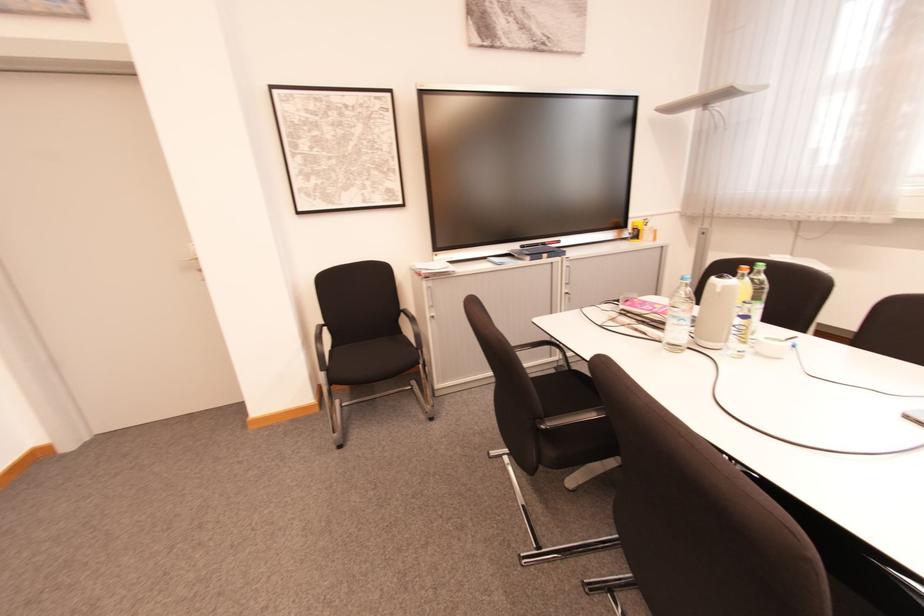
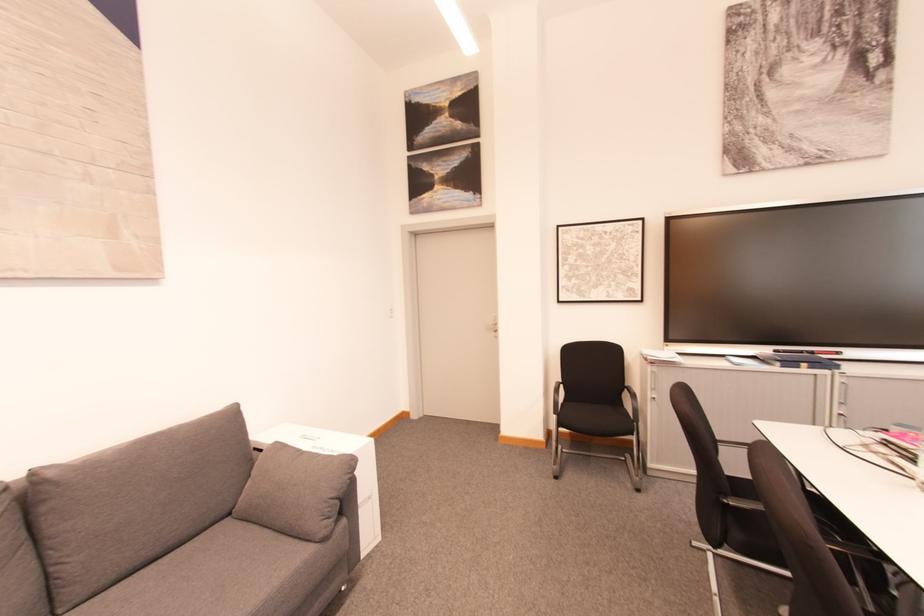
Question: The camera is either moving clockwise (left) or counter-clockwise (right) around the object. The first image is from the beginning of the video and the second image is from the end. Is the camera moving left or right when shooting the video?

Choices:
 (A) Left
 (B) Right

Answer: (B)